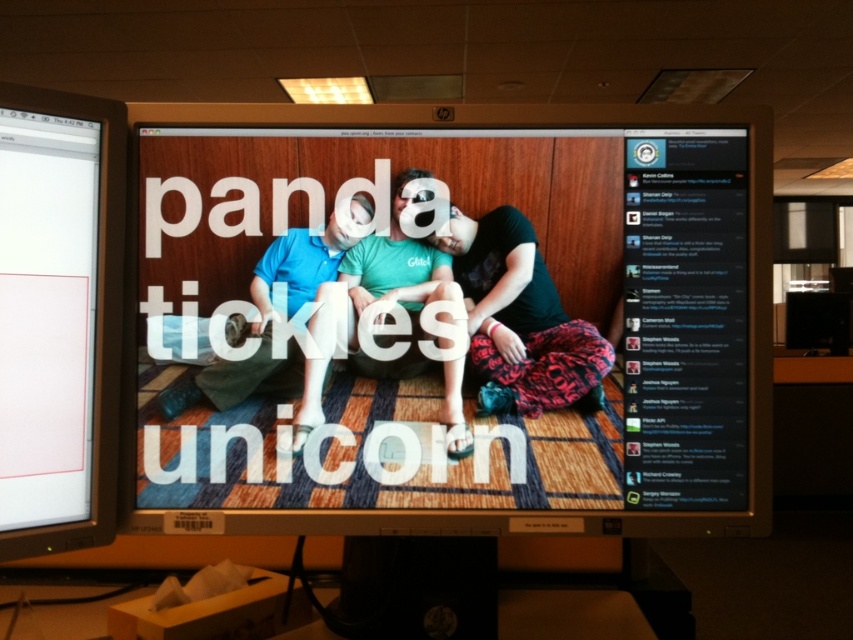
Based on the photo, can you confirm if matte black monitor at left is bigger than blue cotton shirt at center?

Yes.

Is matte black monitor at left wider than blue cotton shirt at center?

In fact, matte black monitor at left might be narrower than blue cotton shirt at center.

Image resolution: width=853 pixels, height=640 pixels. I want to click on matte black monitor at left, so click(x=59, y=317).

Identify the location of matte black monitor at left. click(x=59, y=317).

Can you confirm if matte black monitor at left is positioned to the left of matte green t-shirt at center?

Yes, matte black monitor at left is to the left of matte green t-shirt at center.

Can you confirm if matte black monitor at left is shorter than matte green t-shirt at center?

No, matte black monitor at left is not shorter than matte green t-shirt at center.

Describe the element at coordinates (59, 317) in the screenshot. The height and width of the screenshot is (640, 853). I see `matte black monitor at left` at that location.

You are a GUI agent. You are given a task and a screenshot of the screen. Output one action in this format:
    pyautogui.click(x=<x>, y=<y>)
    Task: Click on the matte black monitor at left
    
    Given the screenshot: What is the action you would take?
    pyautogui.click(x=59, y=317)

Between point (457, 285) and point (257, 268), which one is positioned in front?

Positioned in front is point (257, 268).

Identify the location of matte green t-shirt at center. (375, 300).

The width and height of the screenshot is (853, 640). What do you see at coordinates (375, 300) in the screenshot?
I see `matte green t-shirt at center` at bounding box center [375, 300].

I want to click on matte green t-shirt at center, so click(375, 300).